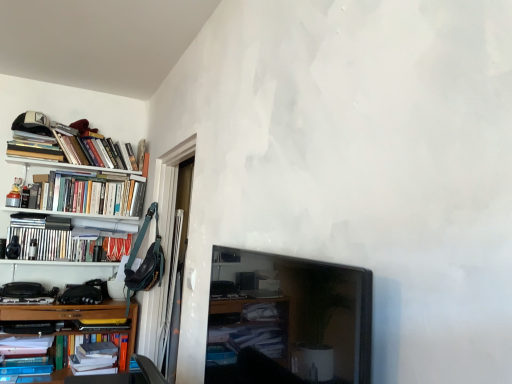
Locate an element on the screen. vacant area on top of hardcover book at lower left, the 1th book in the bottom-to-top sequence (from a real-world perspective) is located at coordinates (99, 347).